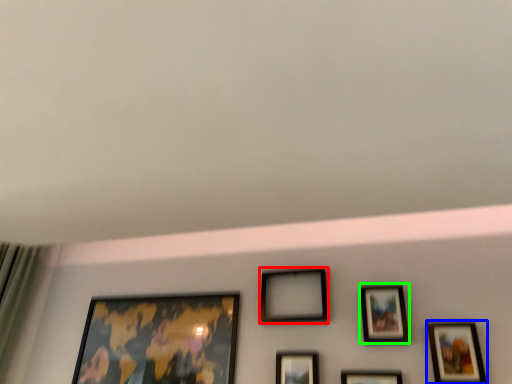
Question: Estimate the real-world distances between objects in this image. Which object is closer to picture frame (highlighted by a red box), picture frame (highlighted by a blue box) or picture frame (highlighted by a green box)?

Choices:
 (A) picture frame
 (B) picture frame

Answer: (B)